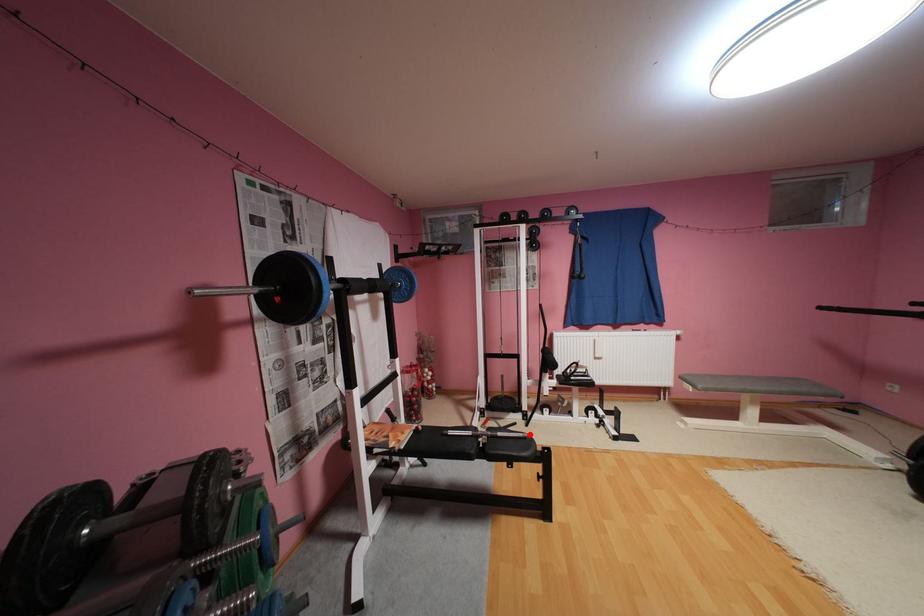
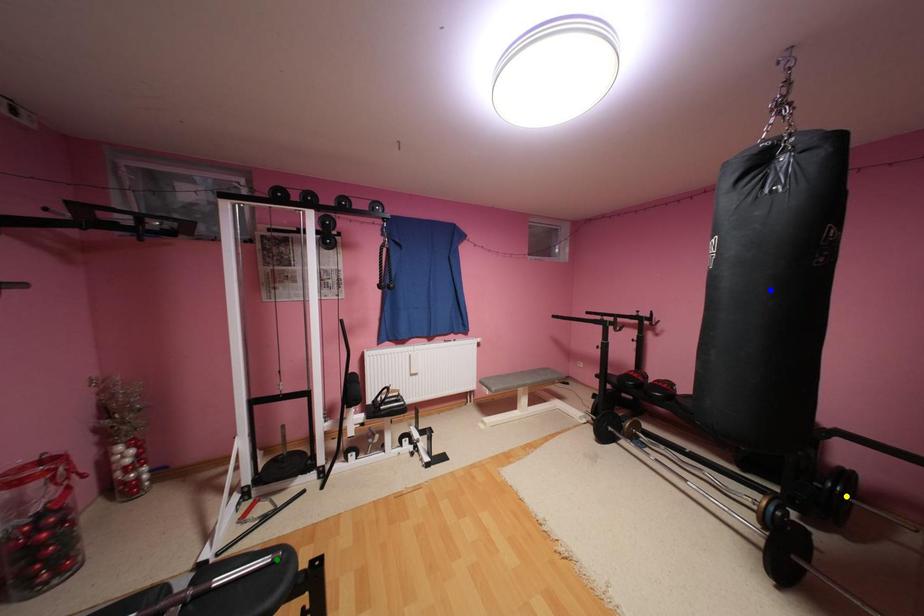
Question: I am providing you with two images of the same scene from different viewpoints. A red point is marked on the first image. You are given multiple points on the second image. Which mark in image 2 goes with the point in image 1?

Choices:
 (A) blue point
 (B) yellow point
 (C) green point

Answer: (C)